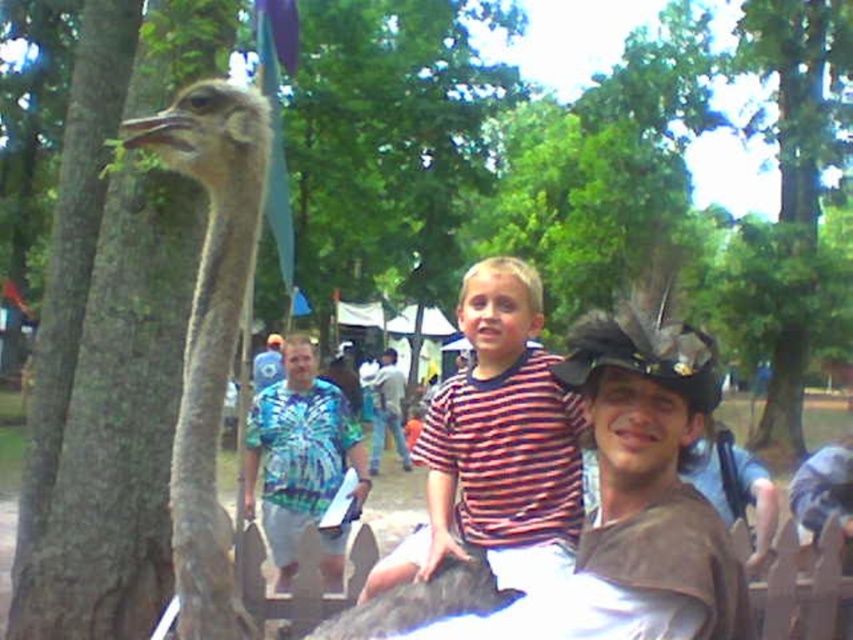
Does point (157, 115) come in front of point (378, 454)?

Yes.

Can you confirm if brown feathered ostrich at left is positioned to the right of blue tie-dye shirt at center?

Indeed, brown feathered ostrich at left is positioned on the right side of blue tie-dye shirt at center.

Which is behind, point (212, 536) or point (403, 433)?

Point (403, 433)

This screenshot has width=853, height=640. In order to click on brown feathered ostrich at left in this screenshot , I will do `click(210, 328)`.

Is striped fabric shirt at center shorter than blue tie-dye shirt at center?

Indeed, striped fabric shirt at center has a lesser height compared to blue tie-dye shirt at center.

Does striped fabric shirt at center appear over blue tie-dye shirt at center?

Indeed, striped fabric shirt at center is positioned over blue tie-dye shirt at center.

Is point (503, 508) positioned behind point (393, 356)?

No, it is in front of (393, 356).

Where is `striped fabric shirt at center`? This screenshot has height=640, width=853. striped fabric shirt at center is located at coordinates (497, 445).

Which is below, striped fabric shirt at center or tie-dye fabric shirt at center?

Positioned lower is tie-dye fabric shirt at center.

Who is taller, striped fabric shirt at center or tie-dye fabric shirt at center?

tie-dye fabric shirt at center

Describe the element at coordinates (497, 445) in the screenshot. I see `striped fabric shirt at center` at that location.

Find the location of a particular element. This screenshot has height=640, width=853. striped fabric shirt at center is located at coordinates (497, 445).